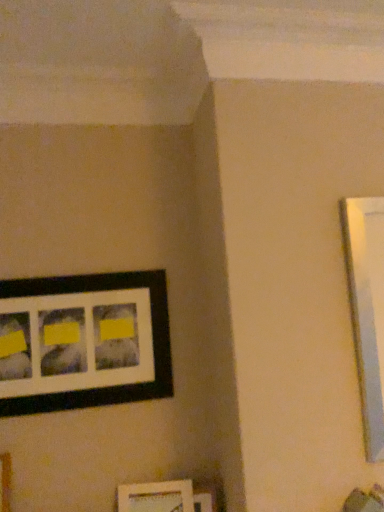
Question: In which direction should I rotate to look at white matte picture frame at lower center, the second picture frame ordered from the bottom?

Choices:
 (A) right
 (B) left

Answer: (B)

Question: From the image's perspective, is matte black picture frame at upper left, which is counted as the first picture frame, starting from the top, below white matte picture frame at lower center, the second picture frame ordered from the bottom?

Choices:
 (A) no
 (B) yes

Answer: (A)

Question: Is matte black picture frame at upper left, which is counted as the first picture frame, starting from the top, with white matte picture frame at lower center, the second picture frame ordered from the bottom?

Choices:
 (A) yes
 (B) no

Answer: (B)

Question: From the image's perspective, does matte black picture frame at upper left, positioned as the third picture frame in bottom-to-top order, appear higher than white matte picture frame at lower center, the 2th picture frame positioned from the top?

Choices:
 (A) yes
 (B) no

Answer: (A)

Question: Considering the relative sizes of matte black picture frame at upper left, positioned as the third picture frame in bottom-to-top order, and white matte picture frame at lower center, the 2th picture frame positioned from the top, in the image provided, is matte black picture frame at upper left, positioned as the third picture frame in bottom-to-top order, wider than white matte picture frame at lower center, the 2th picture frame positioned from the top,?

Choices:
 (A) yes
 (B) no

Answer: (B)

Question: Is matte black picture frame at upper left, positioned as the third picture frame in bottom-to-top order, positioned in front of white matte picture frame at lower center, the second picture frame ordered from the bottom?

Choices:
 (A) no
 (B) yes

Answer: (A)

Question: From a real-world perspective, does matte black picture frame at upper left, positioned as the third picture frame in bottom-to-top order, sit lower than white matte picture frame at lower center, the 2th picture frame positioned from the top?

Choices:
 (A) no
 (B) yes

Answer: (A)

Question: Is there a large distance between matte black picture frame at lower center, which ranks as the 3th picture frame in top-to-bottom order, and white matte picture frame at lower center, the second picture frame ordered from the bottom?

Choices:
 (A) yes
 (B) no

Answer: (B)

Question: From a real-world perspective, is matte black picture frame at lower center, which ranks as the 3th picture frame in top-to-bottom order, located higher than white matte picture frame at lower center, the second picture frame ordered from the bottom?

Choices:
 (A) no
 (B) yes

Answer: (A)

Question: Is matte black picture frame at lower center, which ranks as the 3th picture frame in top-to-bottom order, wider than white matte picture frame at lower center, the 2th picture frame positioned from the top?

Choices:
 (A) no
 (B) yes

Answer: (A)

Question: Can you confirm if matte black picture frame at lower center, which ranks as the 3th picture frame in top-to-bottom order, is taller than white matte picture frame at lower center, the second picture frame ordered from the bottom?

Choices:
 (A) yes
 (B) no

Answer: (A)

Question: Is matte black picture frame at lower center, the first picture frame ordered from the bottom, outside white matte picture frame at lower center, the second picture frame ordered from the bottom?

Choices:
 (A) yes
 (B) no

Answer: (A)

Question: From the image's perspective, does matte black picture frame at lower center, the first picture frame ordered from the bottom, appear lower than white matte picture frame at lower center, the second picture frame ordered from the bottom?

Choices:
 (A) yes
 (B) no

Answer: (A)

Question: Is matte black picture frame at lower center, the first picture frame ordered from the bottom, in contact with matte black picture frame at upper left, which is counted as the first picture frame, starting from the top?

Choices:
 (A) no
 (B) yes

Answer: (A)